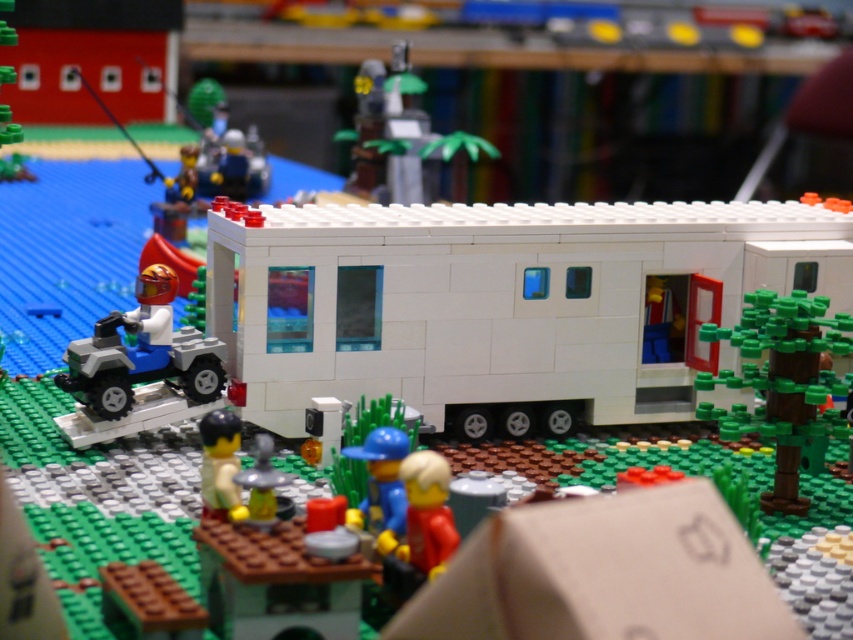
Does white plastic tree at upper center have a lesser height compared to translucent yellow figure at center?

No.

Is white plastic tree at upper center thinner than translucent yellow figure at center?

No.

This screenshot has width=853, height=640. What are the coordinates of `white plastic tree at upper center` in the screenshot? It's located at click(403, 138).

Is black plastic minifigure at lower center bigger than translucent yellow figure at center?

Yes.

Is point (229, 468) less distant than point (273, 493)?

No, (229, 468) is further to viewer.

Locate an element on the screen. The image size is (853, 640). black plastic minifigure at lower center is located at coordinates (219, 465).

Is point (430, 227) closer to viewer compared to point (422, 476)?

No, (430, 227) is further to viewer.

Does point (459, 371) lie in front of point (410, 532)?

No.

Identify the location of white plastic trailer at center. (500, 305).